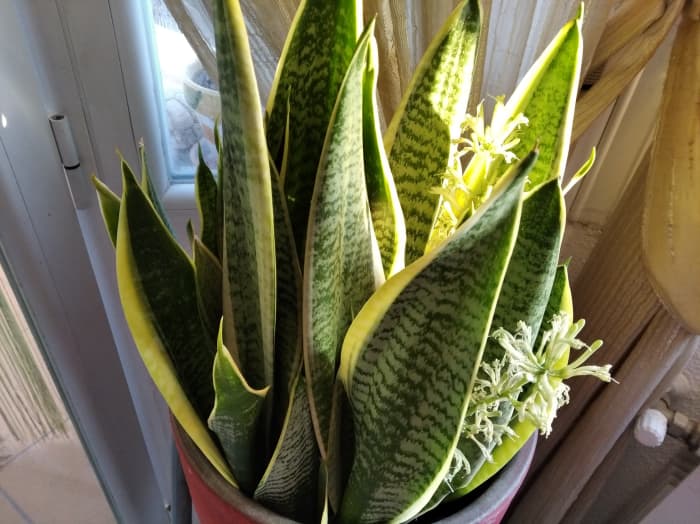
Image resolution: width=700 pixels, height=524 pixels. What are the coordinates of `plant pot` in the screenshot? It's located at (208, 505), (497, 508).